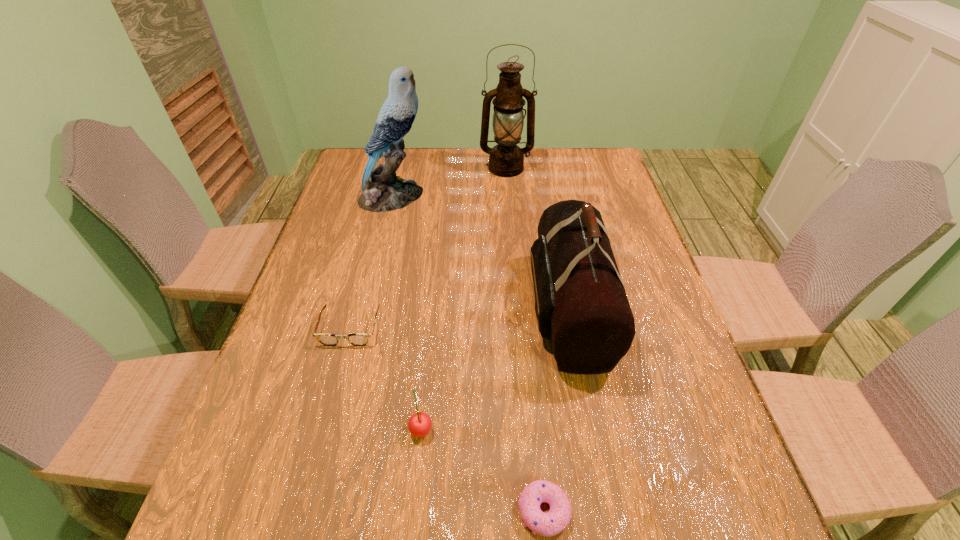
At what (x,y) coordinates should I click in order to perform the action: click on oil lamp. Please return your answer as a coordinate pair (x, y). Image resolution: width=960 pixels, height=540 pixels. Looking at the image, I should click on (506, 159).

Identify the location of parakeet. The height and width of the screenshot is (540, 960). (382, 191).

The image size is (960, 540). I want to click on the third tallest object, so click(x=581, y=305).

Find the location of a particular element. The image size is (960, 540). cherry is located at coordinates (419, 425).

The image size is (960, 540). Find the location of `the fourth object from right to left`. the fourth object from right to left is located at coordinates (419, 425).

Where is `spectacles`? The image size is (960, 540). spectacles is located at coordinates [x=357, y=339].

This screenshot has width=960, height=540. What are the coordinates of `the nearest object` in the screenshot? It's located at (548, 524).

This screenshot has width=960, height=540. Identify the location of free space located on the front of the farthest object. (509, 201).

What are the coordinates of `vacant region located on the face of the fifth nearest object` in the screenshot? It's located at (480, 197).

The image size is (960, 540). What are the coordinates of `free space located 0.340m on the front pocket of the third tallest object` in the screenshot? It's located at (391, 309).